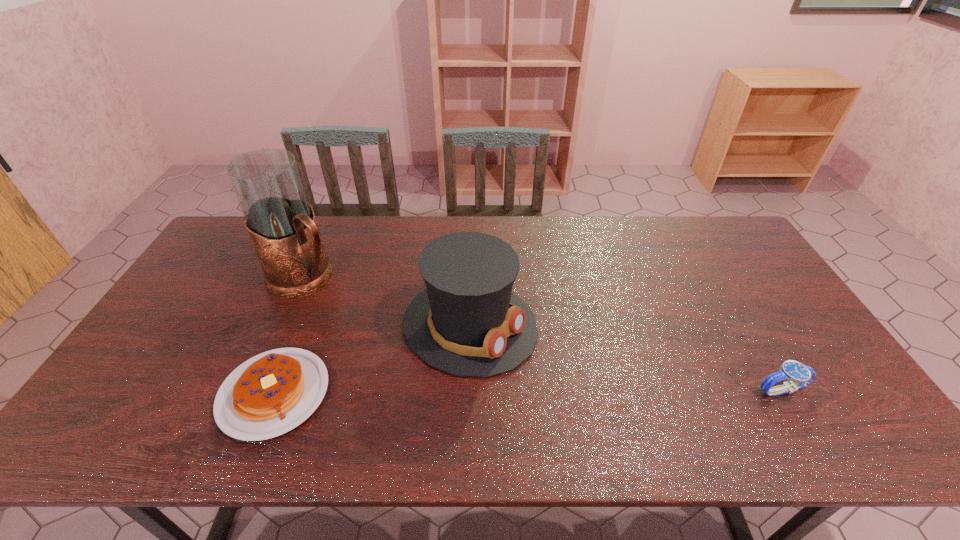
This screenshot has height=540, width=960. What are the coordinates of `vacant point located between the tallest object and the third object from left to right` in the screenshot? It's located at (388, 301).

Where is `unoccupied area between the second shortest object and the third object from left to right`? The height and width of the screenshot is (540, 960). unoccupied area between the second shortest object and the third object from left to right is located at coordinates (626, 358).

I want to click on empty space between the pancake and the pitcher, so click(290, 335).

At what (x,y) coordinates should I click in order to perform the action: click on free space between the pitcher and the shortest object. Please return your answer as a coordinate pair (x, y). Looking at the image, I should click on (290, 335).

You are a GUI agent. You are given a task and a screenshot of the screen. Output one action in this format:
    pyautogui.click(x=<x>, y=<y>)
    Task: Click on the object that is the nearest to the second tallest object
    This screenshot has height=540, width=960.
    Given the screenshot: What is the action you would take?
    pyautogui.click(x=270, y=394)

Select which object appears as the third closest to the pitcher. Please provide its 2D coordinates. Your answer should be formatted as a tuple, i.e. [(x, y)], where the tuple contains the x and y coordinates of a point satisfying the conditions above.

[(799, 375)]

What are the coordinates of `free space that satisfies the following two spatial constraints: 1. on the back side of the watch; 2. on the right side of the pancake` in the screenshot? It's located at (276, 390).

The width and height of the screenshot is (960, 540). Find the location of `vacant region that satisfies the following two spatial constraints: 1. on the back side of the third tallest object; 2. on the left side of the shortest object`. vacant region that satisfies the following two spatial constraints: 1. on the back side of the third tallest object; 2. on the left side of the shortest object is located at coordinates (276, 390).